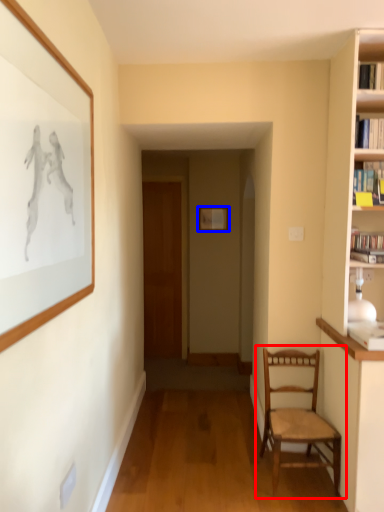
Question: Among these objects, which one is nearest to the camera, chair (highlighted by a red box) or picture frame (highlighted by a blue box)?

Choices:
 (A) chair
 (B) picture frame

Answer: (A)